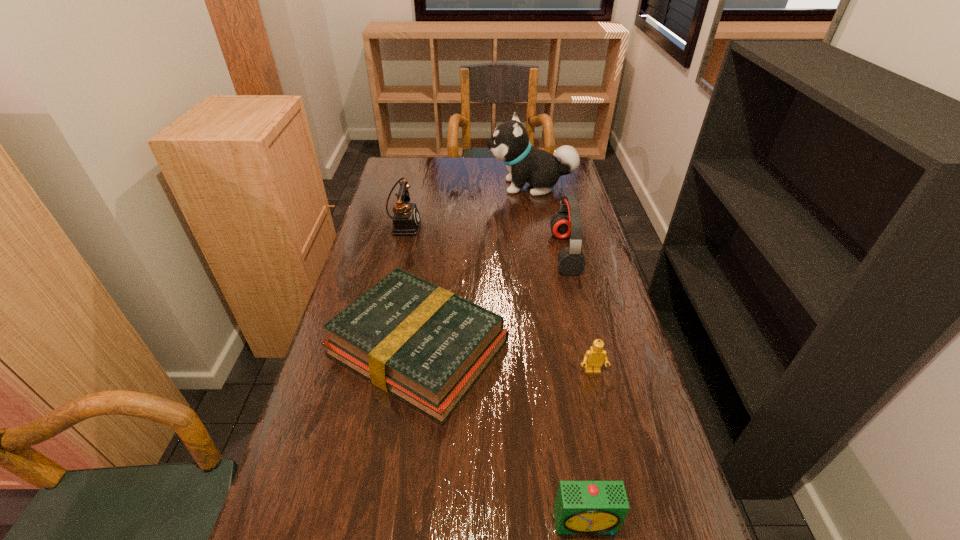
Identify the location of earphone that is at the right edge. The image size is (960, 540). (567, 222).

This screenshot has height=540, width=960. What are the coordinates of `alarm clock situated at the right edge` in the screenshot? It's located at (581, 507).

This screenshot has height=540, width=960. I want to click on Lego at the right edge, so click(x=594, y=357).

You are a GUI agent. You are given a task and a screenshot of the screen. Output one action in this format:
    pyautogui.click(x=<x>, y=<y>)
    Task: Click on the object that is at the far right corner
    This screenshot has width=960, height=540.
    Given the screenshot: What is the action you would take?
    pyautogui.click(x=509, y=143)

Where is `free space at the far edge of the desktop`? free space at the far edge of the desktop is located at coordinates (434, 160).

This screenshot has height=540, width=960. I want to click on vacant space at the left edge of the desktop, so click(x=334, y=514).

You are a GUI agent. You are given a task and a screenshot of the screen. Output one action in this format:
    pyautogui.click(x=<x>, y=<y>)
    Task: Click on the vacant area at the right edge of the desktop
    The width and height of the screenshot is (960, 540).
    Given the screenshot: What is the action you would take?
    pyautogui.click(x=624, y=336)

Locate an element on the screen. The width and height of the screenshot is (960, 540). blank space at the far left corner of the desktop is located at coordinates (399, 157).

The width and height of the screenshot is (960, 540). Identify the location of empty space that is in between the hardback book and the Lego. (505, 360).

At what (x,y) coordinates should I click in order to perform the action: click on vacant space that's between the telephone and the fifth shortest object. Please return your answer as a coordinate pair (x, y). This screenshot has width=960, height=540. Looking at the image, I should click on (485, 239).